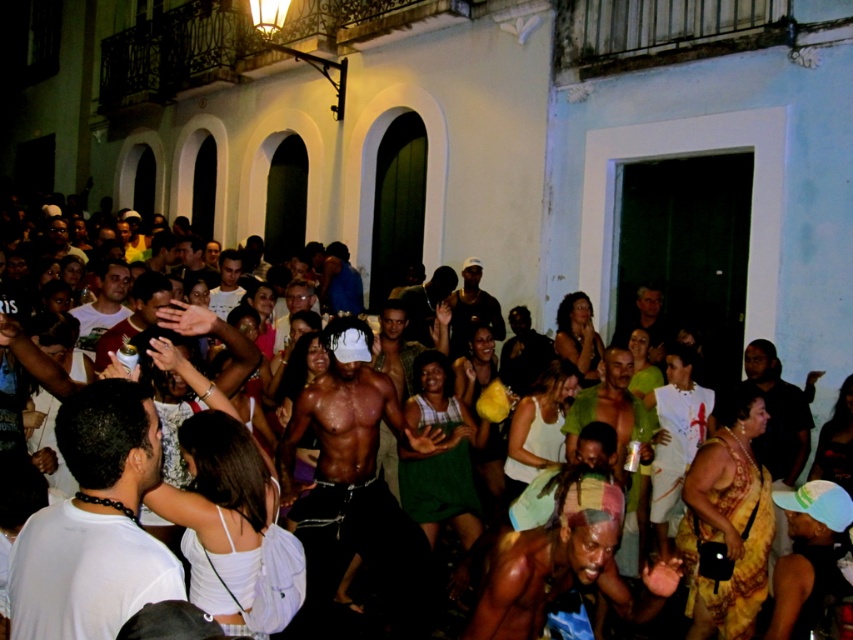
Question: Which point appears closest to the camera in this image?

Choices:
 (A) (97, 588)
 (B) (462, 294)
 (C) (223, 310)
 (D) (593, 500)

Answer: (A)

Question: Does white matte t-shirt at lower left have a lesser width compared to matte white shirt at center?

Choices:
 (A) no
 (B) yes

Answer: (A)

Question: Which object is positioned closest to the white matte t-shirt at lower left?

Choices:
 (A) white matte shirt at center
 (B) matte white shirt at center

Answer: (B)

Question: Is white matte t-shirt at lower left smaller than shiny black shirt at center?

Choices:
 (A) no
 (B) yes

Answer: (B)

Question: Which object appears closest to the camera in this image?

Choices:
 (A) matte white shirt at center
 (B) shiny black shirt at center
 (C) shiny black skin at center

Answer: (B)

Question: Does white matte t-shirt at lower left appear on the right side of shiny black skin at center?

Choices:
 (A) yes
 (B) no

Answer: (B)